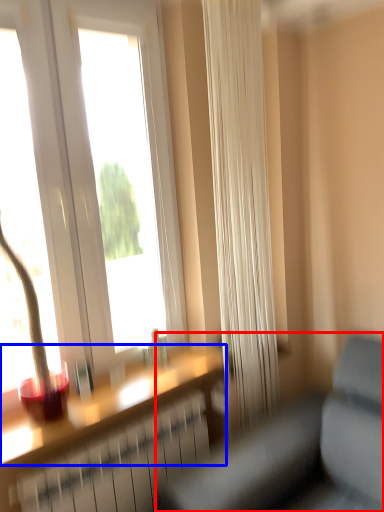
Question: Which of the following is the farthest to the observer, studio couch (highlighted by a red box) or window sill (highlighted by a blue box)?

Choices:
 (A) studio couch
 (B) window sill

Answer: (B)